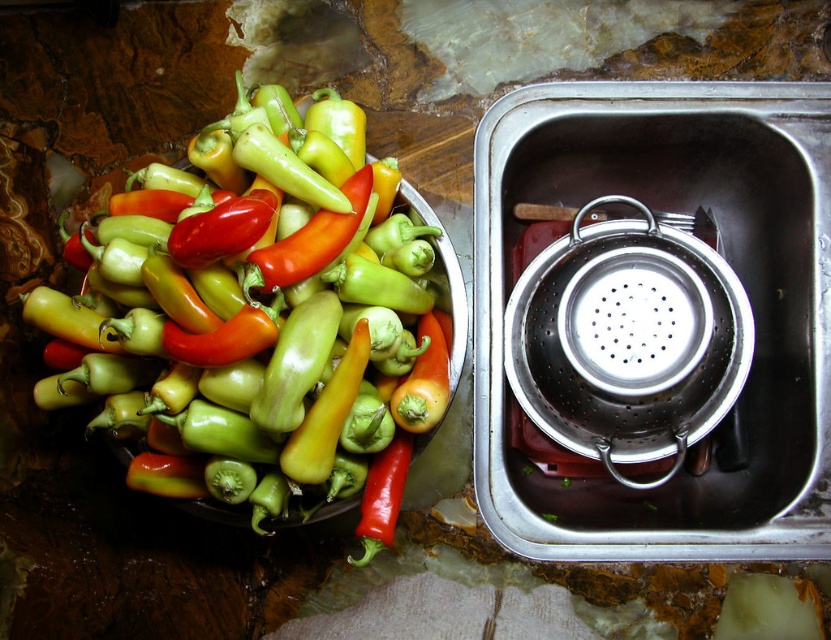
You are a chef preparing vegetables for a salad. You have a glossy green bell pepper at upper left and a silver metallic strainer at right on the kitchen counter. Which object would you need to move first to create space for your cutting board?

The glossy green bell pepper at upper left needs to be moved first because it is larger than the silver metallic strainer at right, making it take up more space on the counter.

You are a chef preparing vegetables and need to move the glossy green bell pepper at upper left into the silver metallic strainer at right. Can you reach the strainer without moving the pepper first?

The glossy green bell pepper at upper left is closer to the viewer than the silver metallic strainer at right, so you can reach the strainer without moving the pepper first.